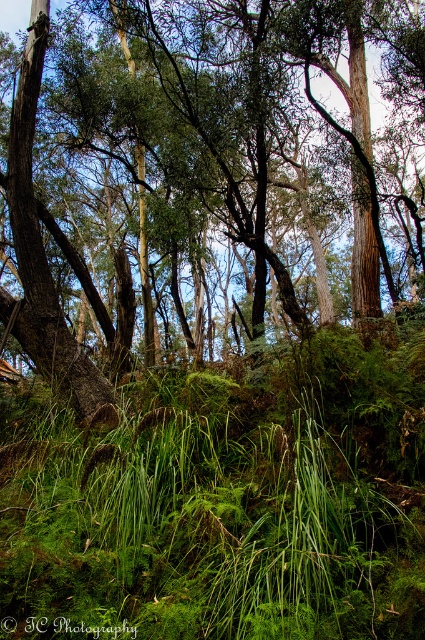
Based on the provided scene description, what does the point at coordinates (217, 156) represent?

The point at coordinates (217, 156) indicates a green leafy tree at center.

You are standing in the forest and want to take a photo of the green leafy tree at center. To ensure the tree is centered in your photo, where should you aim your camera?

You should aim your camera at the point with coordinates 0.245 in the x axis and 0.511 in the y axis since that is the 2D location of the green leafy tree at center.